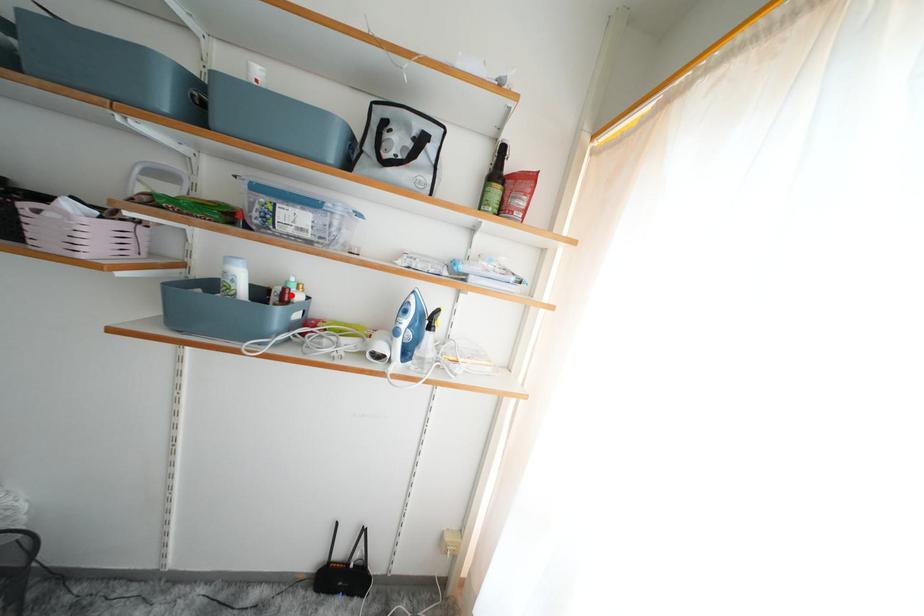
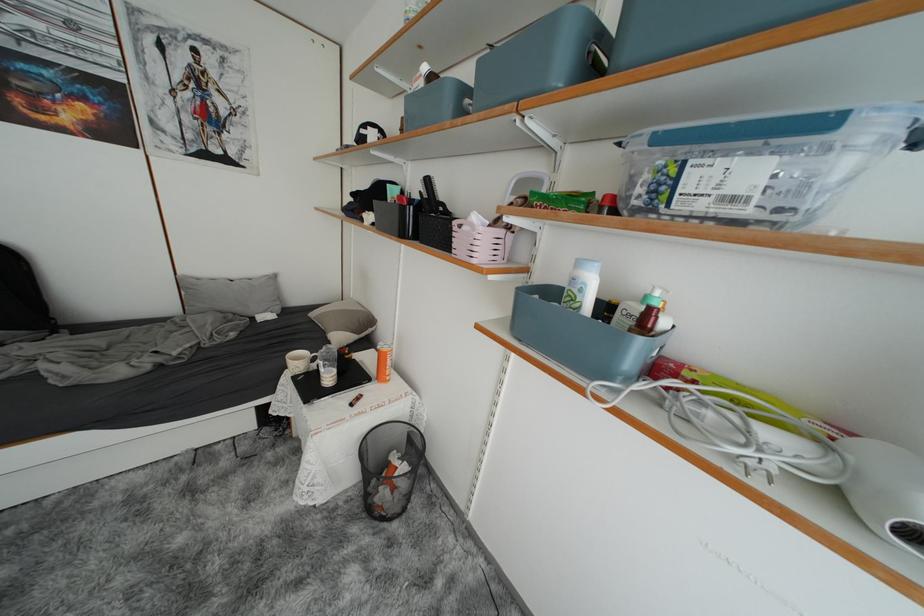
In the second image, find the point that corresponds to the highlighted location in the first image.

(657, 315)